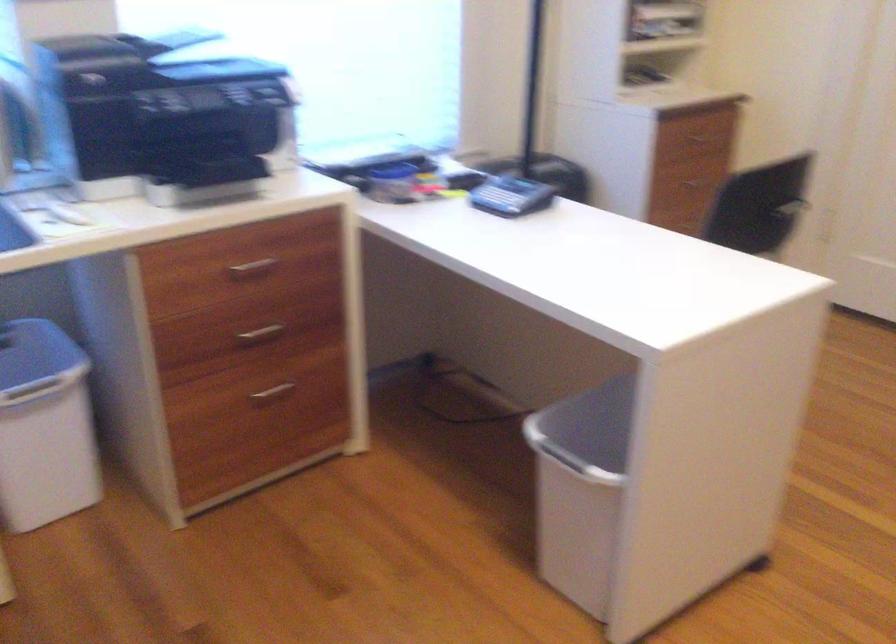
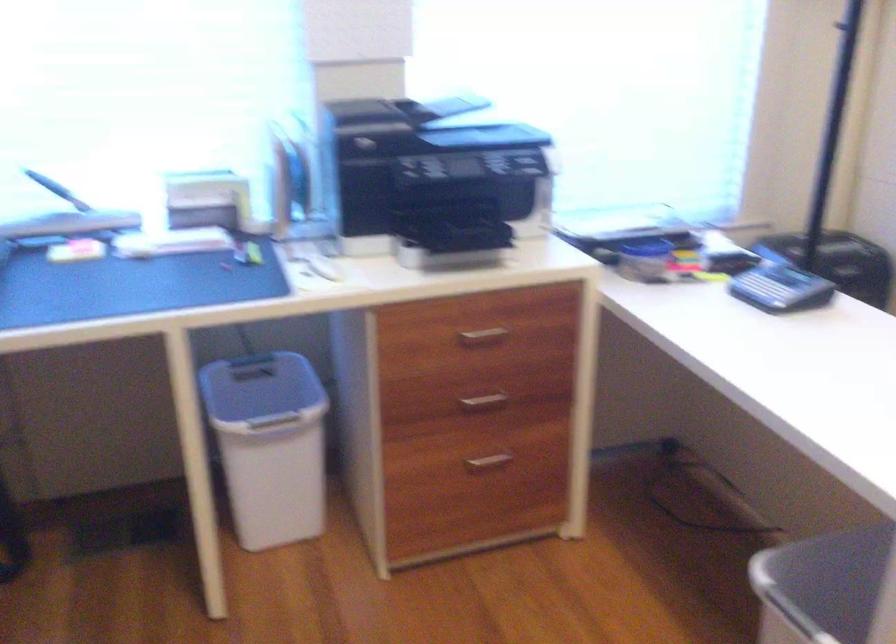
In the second image, find the point that corresponds to pixel 255 333 in the first image.

(484, 401)